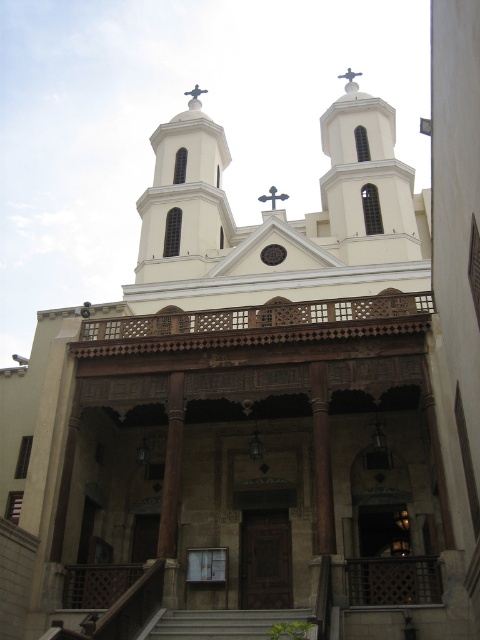
Consider the image. Does white stone tower at upper center appear under gray concrete stairs at center?

No, white stone tower at upper center is not below gray concrete stairs at center.

Which is more to the left, white stone tower at upper center or gray concrete stairs at center?

gray concrete stairs at center is more to the left.

Who is more distant from viewer, (x=425, y=243) or (x=155, y=625)?

The point (x=425, y=243) is behind.

This screenshot has height=640, width=480. I want to click on white stone tower at upper center, so click(x=368, y=182).

Between white stone tower at upper center and metallic cross at center, which one appears on the left side from the viewer's perspective?

From the viewer's perspective, metallic cross at center appears more on the left side.

Between point (381, 164) and point (274, 188), which one is positioned behind?

The point (274, 188) is more distant.

Where is `white stone tower at upper center`? white stone tower at upper center is located at coordinates (368, 182).

Consider the image. Measure the distance from white smooth tower at center to gray concrete stairs at center.

white smooth tower at center is 158.66 feet from gray concrete stairs at center.

Can you confirm if white smooth tower at center is smaller than gray concrete stairs at center?

No.

Where is `white smooth tower at center`? The width and height of the screenshot is (480, 640). white smooth tower at center is located at coordinates (184, 196).